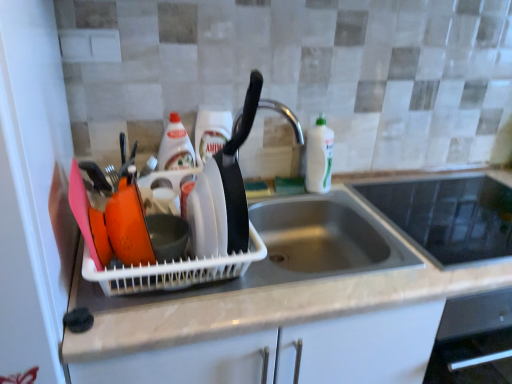
Question: Which direction should I rotate to face white glossy bottle at center, marked as the second bottle in a right-to-left arrangement, — up or down?

Choices:
 (A) down
 (B) up

Answer: (B)

Question: From the image's perspective, is white glossy bottle at center, marked as the second bottle in a right-to-left arrangement, above black glass cooktop at upper right?

Choices:
 (A) no
 (B) yes

Answer: (B)

Question: Does white glossy bottle at center, the second bottle in the left-to-right sequence, come in front of black glass cooktop at upper right?

Choices:
 (A) no
 (B) yes

Answer: (A)

Question: Is white glossy bottle at center, marked as the second bottle in a right-to-left arrangement, located outside black glass cooktop at upper right?

Choices:
 (A) yes
 (B) no

Answer: (A)

Question: Is white glossy bottle at center, the second bottle in the left-to-right sequence, to the left of black glass cooktop at upper right from the viewer's perspective?

Choices:
 (A) no
 (B) yes

Answer: (B)

Question: Is white glossy bottle at center, the second bottle in the left-to-right sequence, positioned behind black glass cooktop at upper right?

Choices:
 (A) yes
 (B) no

Answer: (A)

Question: Does white glossy bottle at center, marked as the second bottle in a right-to-left arrangement, have a larger size compared to black glass cooktop at upper right?

Choices:
 (A) yes
 (B) no

Answer: (B)

Question: Considering the relative sizes of white matte countertop at center and white glossy bottle at sink right, the third bottle positioned from the left, in the image provided, is white matte countertop at center taller than white glossy bottle at sink right, the third bottle positioned from the left,?

Choices:
 (A) yes
 (B) no

Answer: (A)

Question: Is the depth of white matte countertop at center less than that of white glossy bottle at sink right, which is the 1th bottle from right to left?

Choices:
 (A) yes
 (B) no

Answer: (A)

Question: Can you confirm if white matte countertop at center is thinner than white glossy bottle at sink right, which is the 1th bottle from right to left?

Choices:
 (A) no
 (B) yes

Answer: (A)

Question: Can you confirm if white matte countertop at center is positioned to the right of white glossy bottle at sink right, the third bottle positioned from the left?

Choices:
 (A) no
 (B) yes

Answer: (B)

Question: Is white matte countertop at center to the left of white glossy bottle at sink right, the third bottle positioned from the left, from the viewer's perspective?

Choices:
 (A) yes
 (B) no

Answer: (B)

Question: Does white matte countertop at center have a larger size compared to white glossy bottle at sink right, the third bottle positioned from the left?

Choices:
 (A) yes
 (B) no

Answer: (A)

Question: Is white glossy bottle at sink right, the third bottle positioned from the left, at the right side of black glass cooktop at upper right?

Choices:
 (A) no
 (B) yes

Answer: (A)